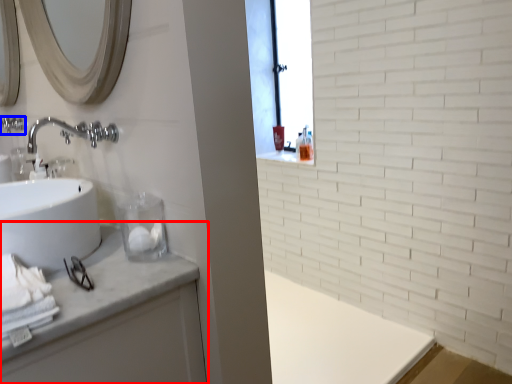
Question: Among these objects, which one is farthest to the camera, bathroom cabinet (highlighted by a red box) or plumbing fixture (highlighted by a blue box)?

Choices:
 (A) bathroom cabinet
 (B) plumbing fixture

Answer: (B)